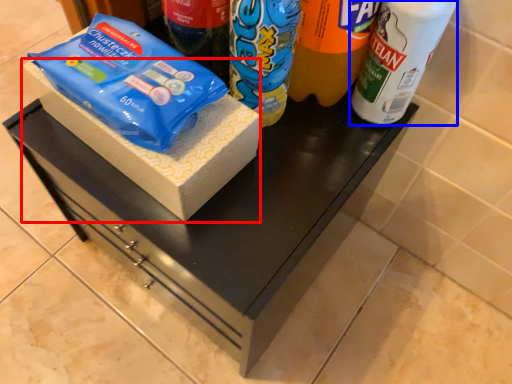
Question: Which object appears farthest to the camera in this image, box (highlighted by a red box) or bottle (highlighted by a blue box)?

Choices:
 (A) box
 (B) bottle

Answer: (A)